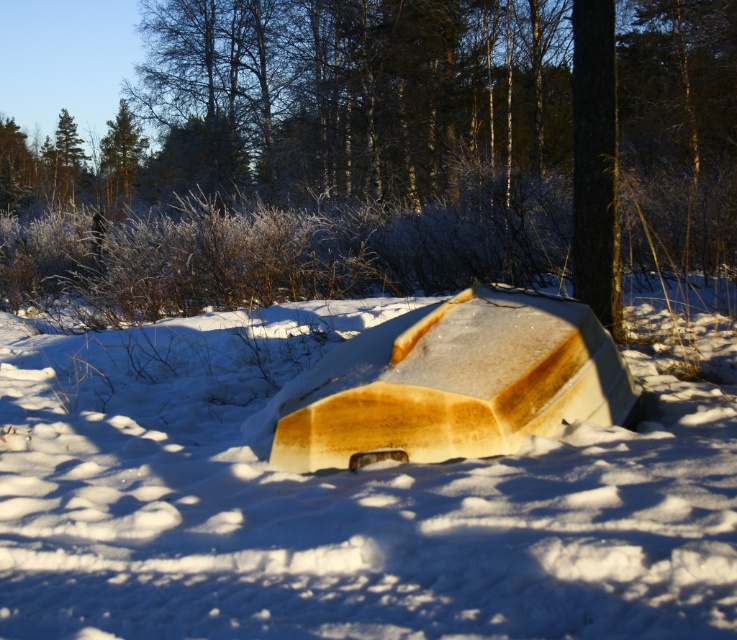
Question: Is wooden canoe at center above green matte tree at upper left?

Choices:
 (A) yes
 (B) no

Answer: (B)

Question: Which point is farther from the camera taking this photo?

Choices:
 (A) (130, 170)
 (B) (178, 360)
 (C) (363, 406)

Answer: (A)

Question: Estimate the real-world distances between objects in this image. Which object is closer to the white matte boat at center?

Choices:
 (A) green matte tree at upper left
 (B) wooden canoe at center

Answer: (B)

Question: Among these points, which one is nearest to the camera?

Choices:
 (A) (136, 164)
 (B) (223, 611)
 (C) (384, 410)

Answer: (B)

Question: Is white matte boat at center to the right of green matte tree at upper left from the viewer's perspective?

Choices:
 (A) no
 (B) yes

Answer: (B)

Question: Is white matte boat at center thinner than green matte tree at upper left?

Choices:
 (A) yes
 (B) no

Answer: (A)